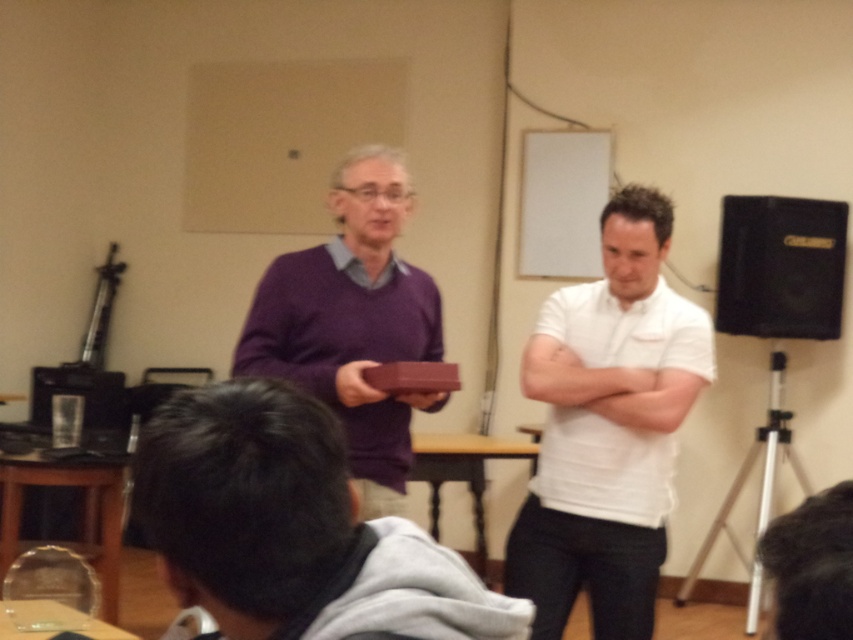
Question: Which point is farther from the camera taking this photo?

Choices:
 (A) (387, 320)
 (B) (828, 248)
 (C) (643, 280)

Answer: (B)

Question: Among these objects, which one is nearest to the camera?

Choices:
 (A) black leather speaker at right
 (B) matte purple sweater at center

Answer: (B)

Question: Can you confirm if white cotton shirt at center is smaller than purple matte sweater at center?

Choices:
 (A) no
 (B) yes

Answer: (A)

Question: Which point appears farthest from the camera in this image?

Choices:
 (A) (752, 307)
 (B) (341, 380)
 (C) (601, 602)

Answer: (A)

Question: Considering the relative positions of purple matte sweater at center and black leather speaker at right in the image provided, where is purple matte sweater at center located with respect to black leather speaker at right?

Choices:
 (A) right
 (B) left

Answer: (B)

Question: Does matte purple sweater at center have a lesser width compared to white cotton shirt at center?

Choices:
 (A) no
 (B) yes

Answer: (B)